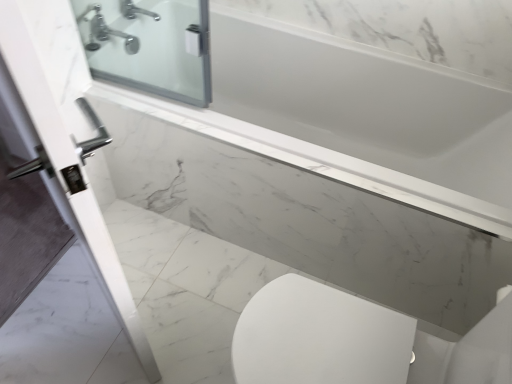
Image resolution: width=512 pixels, height=384 pixels. What are the coordinates of `white glossy door handle at left` in the screenshot? It's located at (63, 137).

Image resolution: width=512 pixels, height=384 pixels. What do you see at coordinates (63, 137) in the screenshot? I see `white glossy door handle at left` at bounding box center [63, 137].

The image size is (512, 384). In order to click on white marble ledge at upper center in this screenshot , I will do `click(317, 160)`.

At what (x,y) coordinates should I click in order to perform the action: click on white glossy door handle at left. Please return your answer as a coordinate pair (x, y). Image resolution: width=512 pixels, height=384 pixels. Looking at the image, I should click on (63, 137).

Based on the photo, is silver metallic faucet at upper left positioned behind white marble ledge at upper center?

Yes, silver metallic faucet at upper left is further from the camera.

Is silver metallic faucet at upper left far away from white marble ledge at upper center?

No.

Is silver metallic faucet at upper left at the left side of white marble ledge at upper center?

Yes.

Consider the image. Which of these two, silver metallic faucet at upper left or white glossy door handle at left, is bigger?

Bigger between the two is white glossy door handle at left.

From their relative heights in the image, would you say silver metallic faucet at upper left is taller or shorter than white glossy door handle at left?

In the image, silver metallic faucet at upper left appears to be shorter than white glossy door handle at left.

Is silver metallic faucet at upper left turned away from white glossy door handle at left?

No, silver metallic faucet at upper left is not facing away from white glossy door handle at left.

Identify the location of screen door below the silver metallic faucet at upper left (from a real-world perspective). (63, 137).

Is white glossy door handle at left closer to the viewer compared to silver metallic faucet at upper left?

Yes, white glossy door handle at left is closer to the viewer.

In the scene shown: Is white glossy door handle at left positioned beyond the bounds of silver metallic faucet at upper left?

Yes.

Considering the relative positions of white glossy door handle at left and silver metallic faucet at upper left in the image provided, is white glossy door handle at left to the left of silver metallic faucet at upper left from the viewer's perspective?

In fact, white glossy door handle at left is to the right of silver metallic faucet at upper left.

From the image's perspective, relative to silver metallic faucet at upper left, is white glossy door handle at left above or below?

white glossy door handle at left is situated lower than silver metallic faucet at upper left in the image.

Based on their positions, is white marble ledge at upper center located to the left or right of white glossy door handle at left?

Clearly, white marble ledge at upper center is on the right of white glossy door handle at left in the image.

Is white marble ledge at upper center not close to white glossy door handle at left?

No.

Is white marble ledge at upper center facing towards white glossy door handle at left?

Yes, white marble ledge at upper center is oriented towards white glossy door handle at left.

How distant is white glossy door handle at left from white marble ledge at upper center?

The distance of white glossy door handle at left from white marble ledge at upper center is 26.51 inches.

From the image's perspective, is white glossy door handle at left located above white marble ledge at upper center?

Yes, from the image's perspective, white glossy door handle at left is over white marble ledge at upper center.

Between white glossy door handle at left and white marble ledge at upper center, which one is positioned in front?

white glossy door handle at left is more forward.

How different are the orientations of white glossy door handle at left and white marble ledge at upper center in degrees?

The angular difference between white glossy door handle at left and white marble ledge at upper center is 31.3 degrees.

Can you confirm if white marble ledge at upper center is shorter than silver metallic faucet at upper left?

In fact, white marble ledge at upper center may be taller than silver metallic faucet at upper left.

Is white marble ledge at upper center at the left side of silver metallic faucet at upper left?

No, white marble ledge at upper center is not to the left of silver metallic faucet at upper left.

Considering the positions of points (220, 140) and (96, 26), is point (220, 140) closer to camera compared to point (96, 26)?

Yes, it is.

Could you tell me if white marble ledge at upper center is turned towards silver metallic faucet at upper left?

No, white marble ledge at upper center is not aimed at silver metallic faucet at upper left.

Where is `tap on the left of white marble ledge at upper center`? tap on the left of white marble ledge at upper center is located at coordinates (105, 32).

You are a GUI agent. You are given a task and a screenshot of the screen. Output one action in this format:
    pyautogui.click(x=<x>, y=<y>)
    Task: Click on the tap positioned vertically above the white glossy door handle at left (from a real-world perspective)
    The image size is (512, 384).
    Given the screenshot: What is the action you would take?
    pyautogui.click(x=105, y=32)

Looking at the image, which one is located closer to white glossy door handle at left, silver metallic faucet at upper left or white marble ledge at upper center?

white marble ledge at upper center lies closer to white glossy door handle at left than the other object.

Which object lies further to the anchor point white glossy door handle at left, white marble ledge at upper center or silver metallic faucet at upper left?

The object further to white glossy door handle at left is silver metallic faucet at upper left.

When comparing their distances from silver metallic faucet at upper left, does white glossy door handle at left or white marble ledge at upper center seem further?

white glossy door handle at left.

From the image, which object appears to be nearer to silver metallic faucet at upper left, white marble ledge at upper center or white glossy door handle at left?

Among the two, white marble ledge at upper center is located nearer to silver metallic faucet at upper left.

Based on their spatial positions, is silver metallic faucet at upper left or white glossy door handle at left further from white marble ledge at upper center?

Based on the image, silver metallic faucet at upper left appears to be further to white marble ledge at upper center.

Estimate the real-world distances between objects in this image. Which object is closer to white marble ledge at upper center, white glossy door handle at left or silver metallic faucet at upper left?

Among the two, white glossy door handle at left is located nearer to white marble ledge at upper center.

The image size is (512, 384). Find the location of `ledge between white glossy door handle at left and silver metallic faucet at upper left in the front-back direction`. ledge between white glossy door handle at left and silver metallic faucet at upper left in the front-back direction is located at coordinates (317, 160).